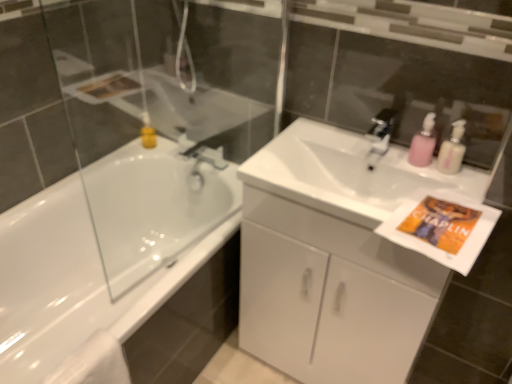
Question: Does white glossy cabinet at center have a lesser height compared to silver metallic faucet at upper center?

Choices:
 (A) yes
 (B) no

Answer: (B)

Question: Is white glossy cabinet at center placed right next to silver metallic faucet at upper center?

Choices:
 (A) yes
 (B) no

Answer: (B)

Question: From the image's perspective, is white glossy cabinet at center under silver metallic faucet at upper center?

Choices:
 (A) no
 (B) yes

Answer: (B)

Question: Could you tell me if white glossy cabinet at center is turned towards silver metallic faucet at upper center?

Choices:
 (A) no
 (B) yes

Answer: (A)

Question: Considering the relative sizes of white glossy cabinet at center and silver metallic faucet at upper center in the image provided, is white glossy cabinet at center smaller than silver metallic faucet at upper center?

Choices:
 (A) no
 (B) yes

Answer: (A)

Question: Visually, is white matte towel at lower left positioned to the left or to the right of pink plastic pump at upper right?

Choices:
 (A) left
 (B) right

Answer: (A)

Question: Which is correct: white matte towel at lower left is inside pink plastic pump at upper right, or outside of it?

Choices:
 (A) outside
 (B) inside

Answer: (A)

Question: In terms of height, does white matte towel at lower left look taller or shorter compared to pink plastic pump at upper right?

Choices:
 (A) short
 (B) tall

Answer: (B)

Question: In terms of width, does white matte towel at lower left look wider or thinner when compared to pink plastic pump at upper right?

Choices:
 (A) thin
 (B) wide

Answer: (B)

Question: Is white glossy sink at center to the left or to the right of pink plastic pump at upper right in the image?

Choices:
 (A) left
 (B) right

Answer: (A)

Question: In terms of size, does white glossy sink at center appear bigger or smaller than pink plastic pump at upper right?

Choices:
 (A) small
 (B) big

Answer: (B)

Question: Is white glossy sink at center in front of or behind pink plastic pump at upper right in the image?

Choices:
 (A) behind
 (B) front

Answer: (B)

Question: Is point (481, 173) closer or farther from the camera than point (457, 163)?

Choices:
 (A) closer
 (B) farther

Answer: (A)

Question: Considering their positions, is pink plastic soap dispenser at upper right located in front of or behind white matte towel at lower left?

Choices:
 (A) behind
 (B) front

Answer: (A)

Question: Based on their positions, is pink plastic soap dispenser at upper right located to the left or right of white matte towel at lower left?

Choices:
 (A) right
 (B) left

Answer: (A)